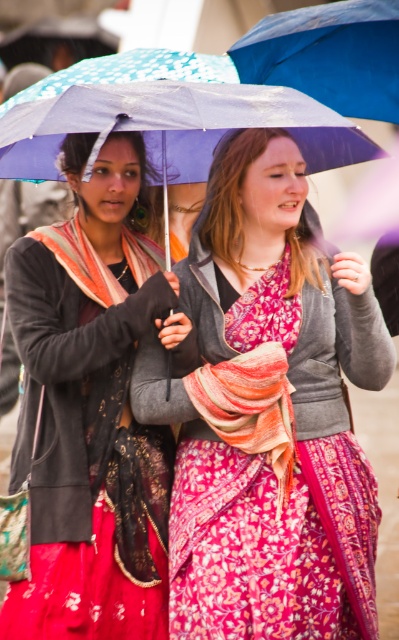
In the scene shown: You are a photographer trying to position a matte purple umbrella at center for a photo shoot. Given its current coordinates at point 0.645, 0.674, where exactly should you place it to ensure it is centered in the frame?

The matte purple umbrella at center is already positioned at point [268,412], which is the center of the frame according to the coordinates provided.

You are a photographer trying to capture a closeup of the matte black scarf at left while ensuring the blue fabric umbrella at upper center is still visible in the frame. Based on their positions, can you confirm if the umbrella will appear above the scarf in the photo?

The matte black scarf at left is located below the blue fabric umbrella at upper center, so yes, the umbrella will appear above the scarf in the photo.